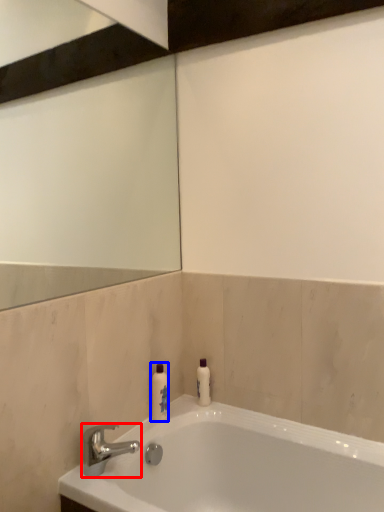
Question: Which object appears closest to the camera in this image, tap (highlighted by a red box) or toiletry (highlighted by a blue box)?

Choices:
 (A) tap
 (B) toiletry

Answer: (A)